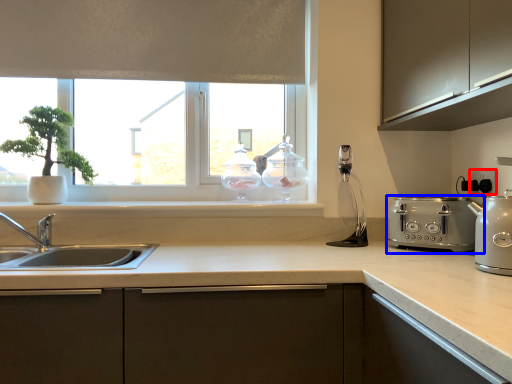
Question: Which object appears closest to the camera in this image, electric outlet (highlighted by a red box) or toaster (highlighted by a blue box)?

Choices:
 (A) electric outlet
 (B) toaster

Answer: (B)